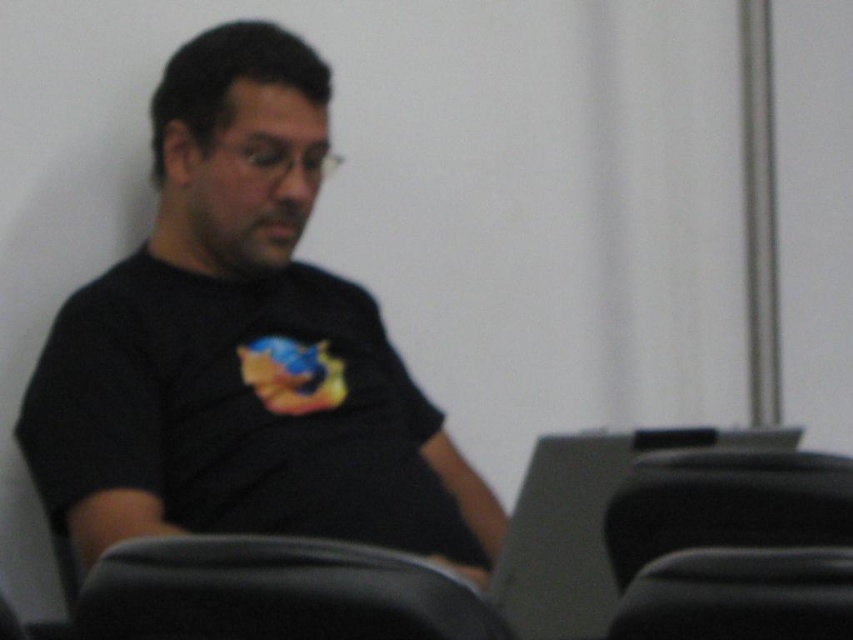
Question: Which point is closer to the camera?

Choices:
 (A) black plastic swivel chair at lower right
 (B) black leather chair at lower right
 (C) black leather chair at lower center

Answer: (C)

Question: Can you confirm if black leather chair at lower center is positioned to the right of black leather chair at lower right?

Choices:
 (A) yes
 (B) no

Answer: (B)

Question: Is black leather chair at lower center to the right of black leather chair at lower right from the viewer's perspective?

Choices:
 (A) no
 (B) yes

Answer: (A)

Question: Based on their relative distances, which object is nearer to the black leather chair at lower center?

Choices:
 (A) black matte t-shirt at center
 (B) black plastic swivel chair at lower right

Answer: (B)

Question: Is black plastic swivel chair at lower right above black leather chair at lower right?

Choices:
 (A) no
 (B) yes

Answer: (B)

Question: Which object appears farthest from the camera in this image?

Choices:
 (A) black plastic swivel chair at lower right
 (B) black matte t-shirt at center
 (C) black leather chair at lower center
 (D) black leather chair at lower right

Answer: (B)